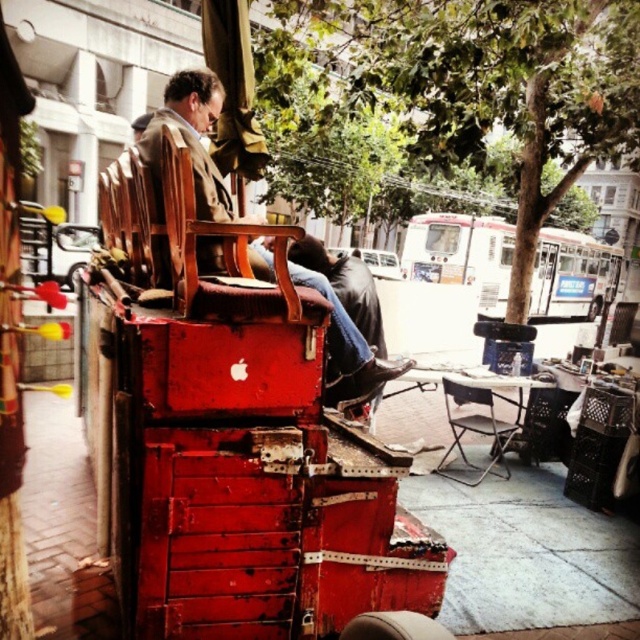
Can you confirm if wooden chair at center is smaller than metallic silver folding chair at center?

Incorrect, wooden chair at center is not smaller in size than metallic silver folding chair at center.

Between wooden chair at center and metallic silver folding chair at center, which one has less height?

metallic silver folding chair at center

Describe the element at coordinates (195, 136) in the screenshot. I see `wooden chair at center` at that location.

This screenshot has height=640, width=640. In order to click on wooden chair at center in this screenshot , I will do `click(195, 136)`.